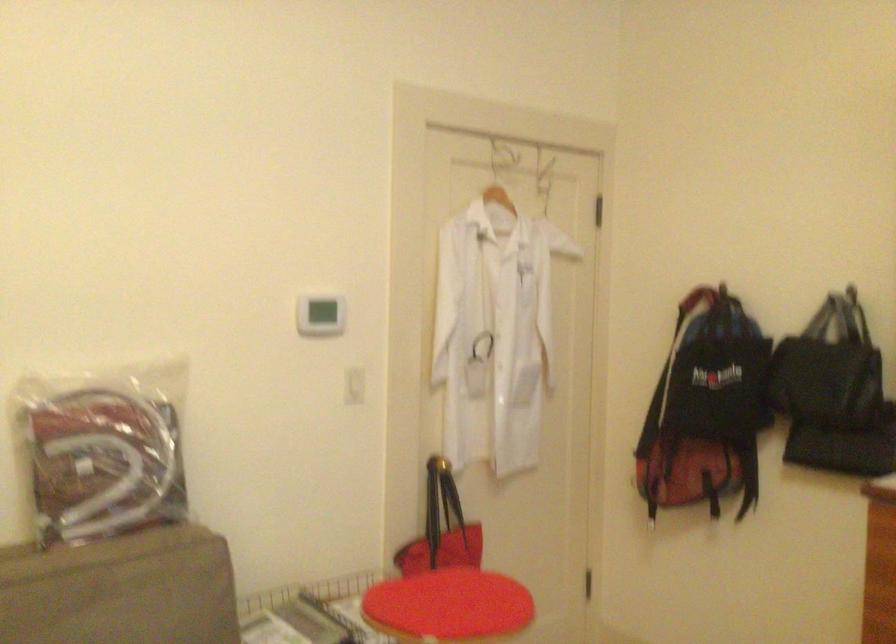
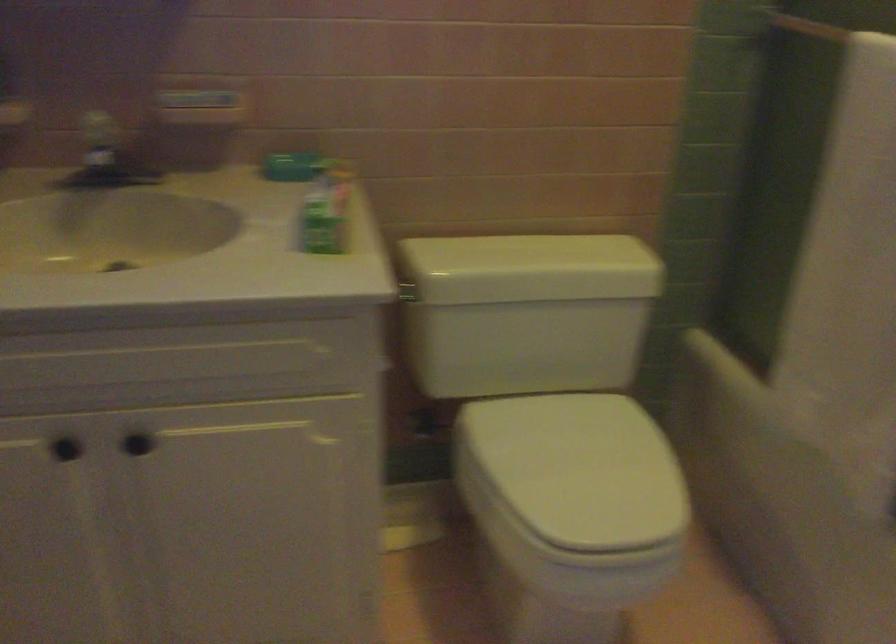
In a continuous first-person perspective shot, in which direction is the camera moving?

The movement direction of the cameraman is left, backward.